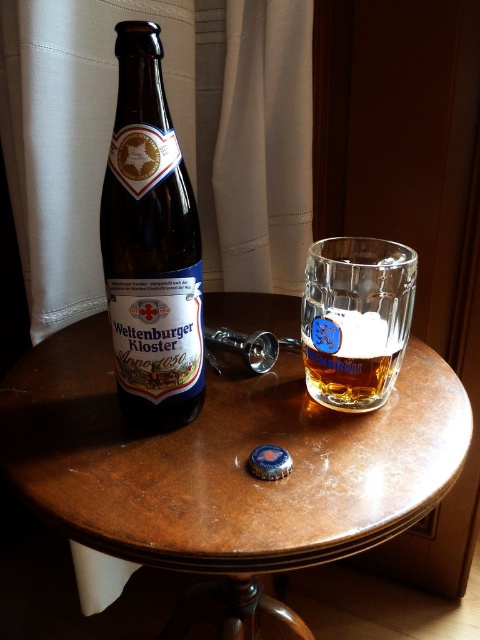
Question: From the image, what is the correct spatial relationship of brown wooden table at center in relation to clear glass mug at center?

Choices:
 (A) right
 (B) left

Answer: (B)

Question: Which point appears closest to the camera in this image?

Choices:
 (A) (183, 358)
 (B) (419, 499)

Answer: (B)

Question: Which object appears farthest from the camera in this image?

Choices:
 (A) brown wooden table at center
 (B) clear glass mug at center

Answer: (B)

Question: Among these objects, which one is farthest from the camera?

Choices:
 (A) clear glass mug at center
 (B) brown wooden table at center

Answer: (A)

Question: Does dark brown glass bottle at left have a larger size compared to clear glass mug at center?

Choices:
 (A) no
 (B) yes

Answer: (B)

Question: Can you confirm if brown wooden table at center is positioned to the right of clear glass mug at center?

Choices:
 (A) yes
 (B) no

Answer: (B)